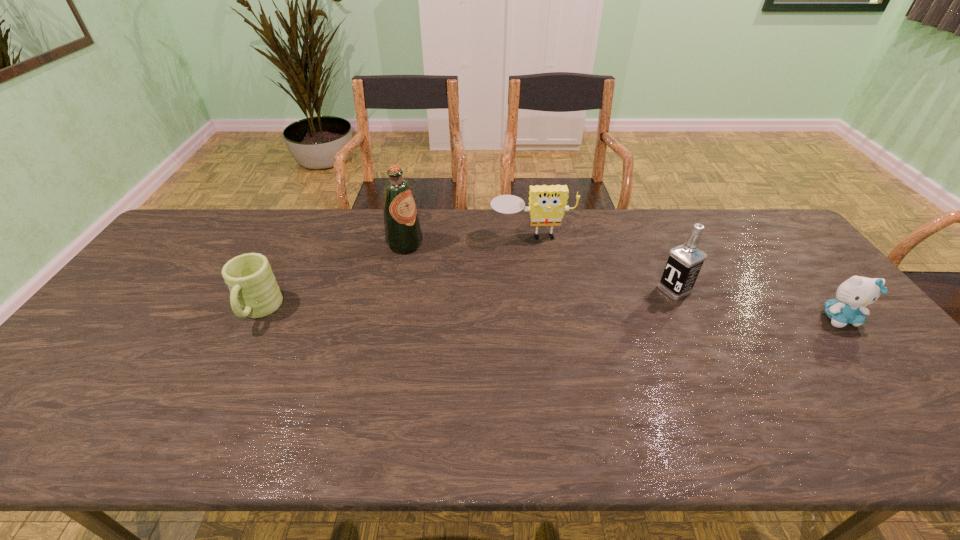
This screenshot has height=540, width=960. I want to click on vacant area between the olive oil and the rightmost object, so click(x=622, y=281).

The image size is (960, 540). I want to click on free space between the fourth object from left to right and the kitten, so click(756, 304).

This screenshot has width=960, height=540. I want to click on unoccupied position between the kitten and the second object from left to right, so click(622, 281).

Where is `free space between the mug and the third tallest object`? Image resolution: width=960 pixels, height=540 pixels. free space between the mug and the third tallest object is located at coordinates (396, 273).

I want to click on free spot between the third tallest object and the mug, so click(x=396, y=273).

Locate which object ranks fourth in proximity to the leftmost object. Please provide its 2D coordinates. Your answer should be formatted as a tuple, i.e. [(x, y)], where the tuple contains the x and y coordinates of a point satisfying the conditions above.

[(854, 294)]

Where is `object that is the closest to the tallest object`? Image resolution: width=960 pixels, height=540 pixels. object that is the closest to the tallest object is located at coordinates click(547, 204).